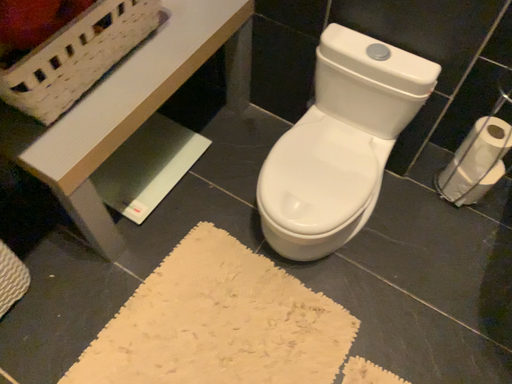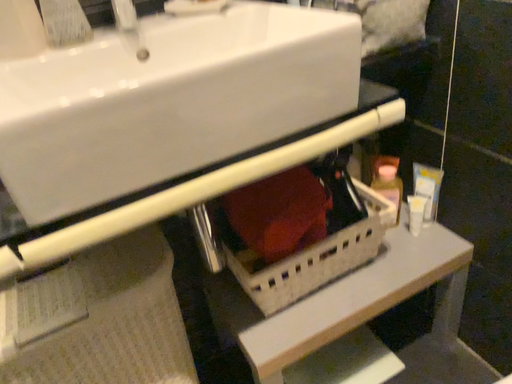
Question: Which way did the camera rotate in the video?

Choices:
 (A) rotated right
 (B) rotated left

Answer: (B)